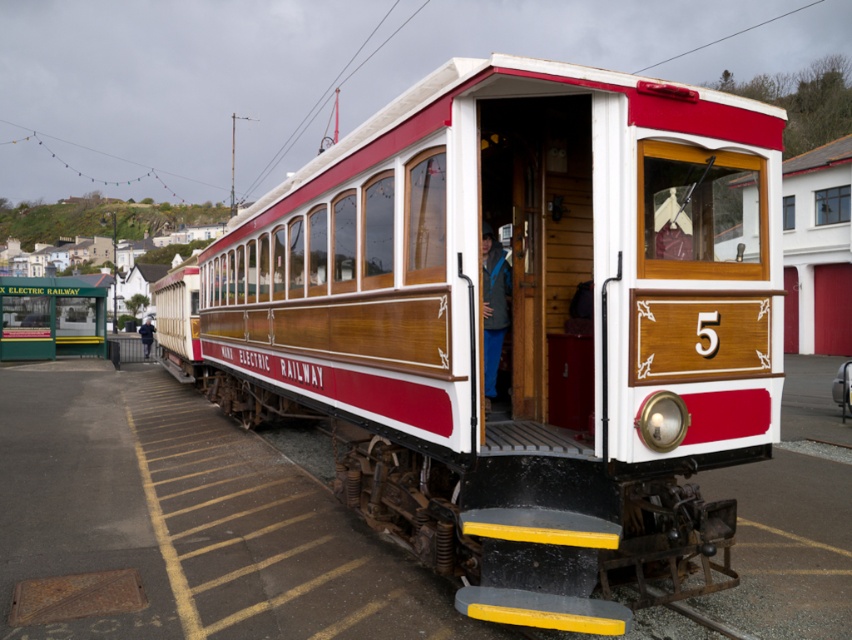
Question: Which of the following is the closest to the observer?

Choices:
 (A) dark blue jacket at center
 (B) blue denim pants at center
 (C) wooden panel train at center

Answer: (C)

Question: Which point is closer to the camera taking this photo?

Choices:
 (A) (493, 269)
 (B) (320, 307)

Answer: (A)

Question: Is blue denim pants at center to the right of dark blue jacket at center from the viewer's perspective?

Choices:
 (A) yes
 (B) no

Answer: (A)

Question: Is blue denim pants at center below dark blue jacket at center?

Choices:
 (A) no
 (B) yes

Answer: (A)

Question: Which object appears closest to the camera in this image?

Choices:
 (A) wooden panel train at center
 (B) blue denim pants at center

Answer: (A)

Question: Can you confirm if blue denim pants at center is positioned to the left of dark blue jacket at center?

Choices:
 (A) yes
 (B) no

Answer: (B)